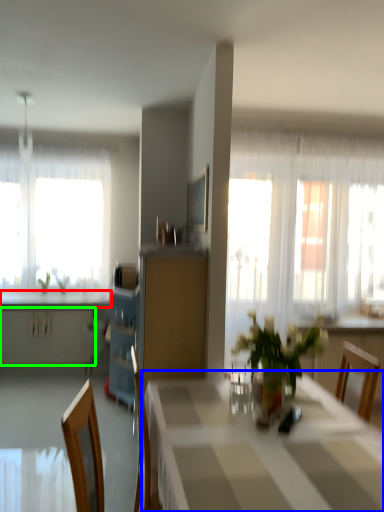
Question: Considering the real-world distances, which object is farthest from countertop (highlighted by a red box)? table (highlighted by a blue box) or radiator (highlighted by a green box)?

Choices:
 (A) table
 (B) radiator

Answer: (A)